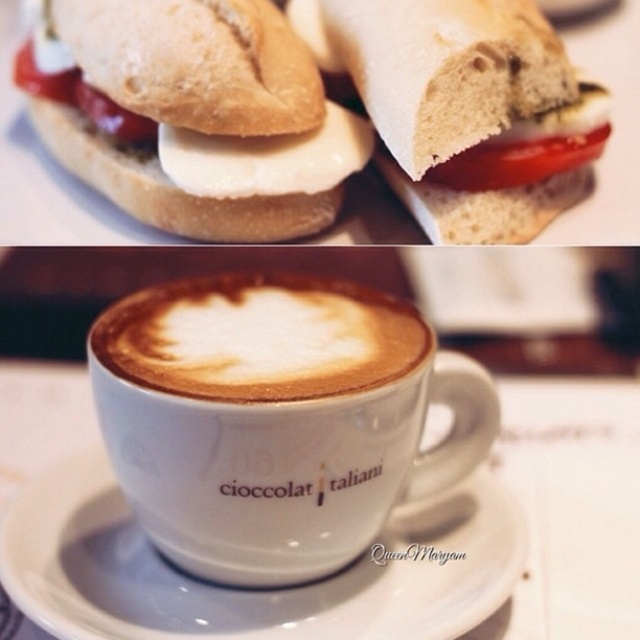
Between white soft bread at upper center and red glossy tomato at center, which one appears on the right side from the viewer's perspective?

red glossy tomato at center

Is white soft bread at upper center taller than red glossy tomato at center?

Correct, white soft bread at upper center is much taller as red glossy tomato at center.

What do you see at coordinates (465, 108) in the screenshot? Image resolution: width=640 pixels, height=640 pixels. I see `white soft bread at upper center` at bounding box center [465, 108].

Locate an element on the screen. white soft bread at upper center is located at coordinates (465, 108).

The height and width of the screenshot is (640, 640). In order to click on white ceramic saucer at center in this screenshot , I will do `click(248, 589)`.

Between white ceramic saucer at center and red glossy tomato at center, which one appears on the right side from the viewer's perspective?

red glossy tomato at center

Locate an element on the screen. The image size is (640, 640). white ceramic saucer at center is located at coordinates (248, 589).

Identify the location of white ceramic saucer at center. Image resolution: width=640 pixels, height=640 pixels. click(x=248, y=589).

Who is taller, white matte cup at center or red glossy tomato at center?

white matte cup at center

Identify the location of white matte cup at center. (276, 419).

At what (x,y) coordinates should I click in order to perform the action: click on white matte cup at center. Please return your answer as a coordinate pair (x, y). Looking at the image, I should click on [x=276, y=419].